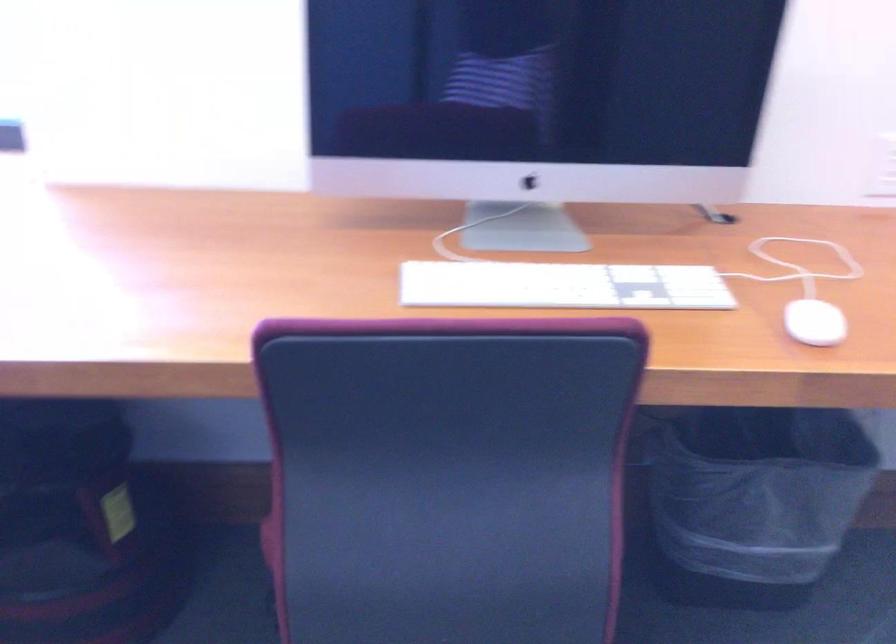
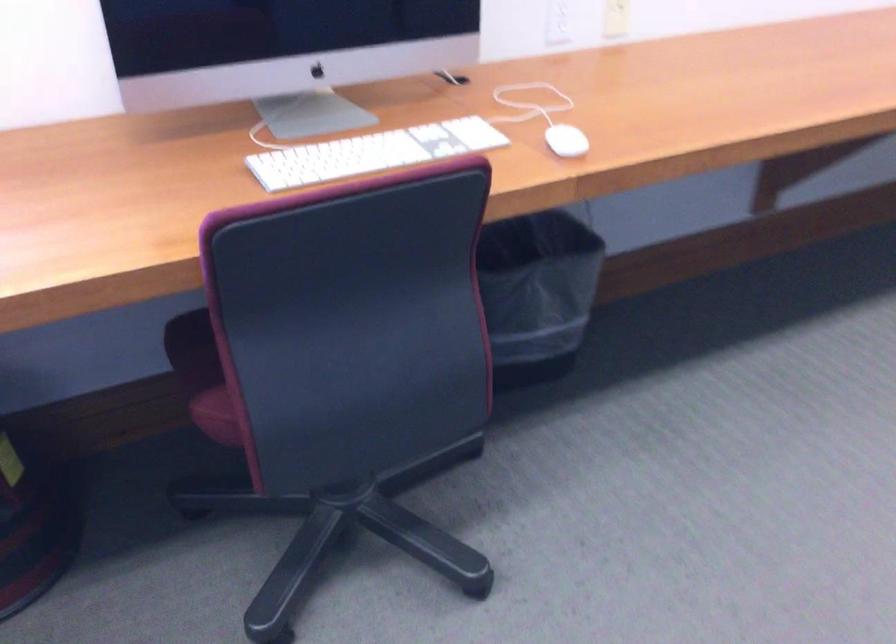
Find the pixel in the second image that matches (279,542) in the first image.

(220, 413)